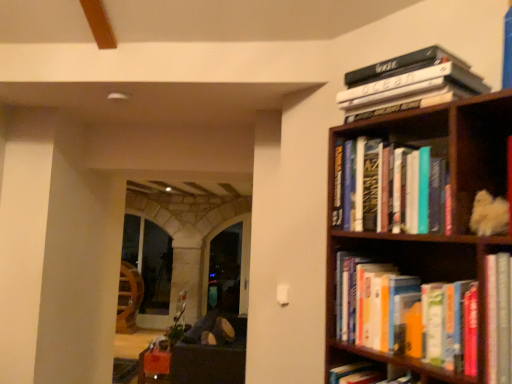
Question: Is hardcover books at upper right, the 2th book ordered from the bottom, oriented towards hardcover books at right, marked as the 3th book in a top-to-bottom arrangement?

Choices:
 (A) no
 (B) yes

Answer: (A)

Question: Considering the relative sizes of hardcover books at upper right, acting as the second book starting from the top, and hardcover books at right, marked as the 3th book in a top-to-bottom arrangement, in the image provided, is hardcover books at upper right, acting as the second book starting from the top, thinner than hardcover books at right, marked as the 3th book in a top-to-bottom arrangement,?

Choices:
 (A) yes
 (B) no

Answer: (A)

Question: Is hardcover books at upper right, acting as the second book starting from the top, behind hardcover books at right, which is counted as the 1th book, starting from the bottom?

Choices:
 (A) no
 (B) yes

Answer: (B)

Question: Does hardcover books at upper right, acting as the second book starting from the top, have a greater height compared to hardcover books at right, marked as the 3th book in a top-to-bottom arrangement?

Choices:
 (A) no
 (B) yes

Answer: (B)

Question: From a real-world perspective, is hardcover books at upper right, the 2th book ordered from the bottom, below hardcover books at right, marked as the 3th book in a top-to-bottom arrangement?

Choices:
 (A) no
 (B) yes

Answer: (A)

Question: Relative to dark brown leather couch at lower left, is hardcover books at upper right, acting as the second book starting from the top, in front or behind?

Choices:
 (A) front
 (B) behind

Answer: (A)

Question: From a real-world perspective, relative to dark brown leather couch at lower left, is hardcover books at upper right, the 2th book ordered from the bottom, vertically above or below?

Choices:
 (A) below
 (B) above

Answer: (B)

Question: Is hardcover books at upper right, the 2th book ordered from the bottom, taller or shorter than dark brown leather couch at lower left?

Choices:
 (A) tall
 (B) short

Answer: (B)

Question: Considering the relative positions of hardcover books at upper right, acting as the second book starting from the top, and dark brown leather couch at lower left in the image provided, is hardcover books at upper right, acting as the second book starting from the top, to the left or to the right of dark brown leather couch at lower left?

Choices:
 (A) left
 (B) right

Answer: (B)

Question: Considering the positions of hardcover books at upper right, which is counted as the 3th book, starting from the bottom, and hardcover books at right, marked as the 3th book in a top-to-bottom arrangement, in the image, is hardcover books at upper right, which is counted as the 3th book, starting from the bottom, wider or thinner than hardcover books at right, marked as the 3th book in a top-to-bottom arrangement,?

Choices:
 (A) wide
 (B) thin

Answer: (A)

Question: Considering the positions of hardcover books at upper right, the 1th book viewed from the top, and hardcover books at right, marked as the 3th book in a top-to-bottom arrangement, in the image, is hardcover books at upper right, the 1th book viewed from the top, taller or shorter than hardcover books at right, marked as the 3th book in a top-to-bottom arrangement,?

Choices:
 (A) short
 (B) tall

Answer: (A)

Question: From a real-world perspective, is hardcover books at upper right, the 1th book viewed from the top, physically located above or below hardcover books at right, marked as the 3th book in a top-to-bottom arrangement?

Choices:
 (A) below
 (B) above

Answer: (B)

Question: From the image's perspective, is hardcover books at upper right, the 1th book viewed from the top, above or below hardcover books at right, marked as the 3th book in a top-to-bottom arrangement?

Choices:
 (A) above
 (B) below

Answer: (A)

Question: Considering the positions of point (406, 82) and point (179, 375), is point (406, 82) closer or farther from the camera than point (179, 375)?

Choices:
 (A) farther
 (B) closer

Answer: (B)

Question: From a real-world perspective, is hardcover books at upper right, the 1th book viewed from the top, above or below dark brown leather couch at lower left?

Choices:
 (A) above
 (B) below

Answer: (A)